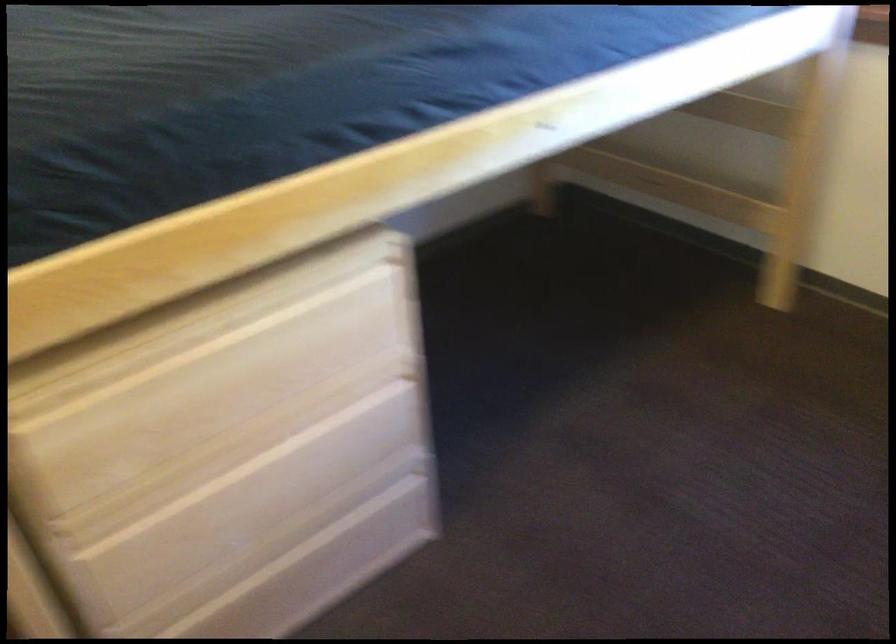
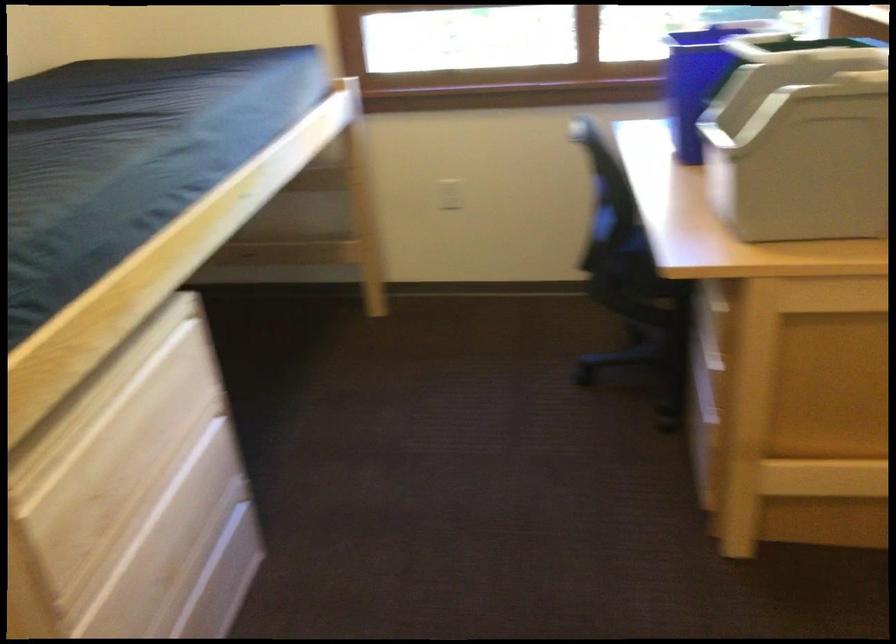
Question: The first image is from the beginning of the video and the second image is from the end. How did the camera likely rotate when shooting the video?

Choices:
 (A) Left
 (B) Right
 (C) Up
 (D) Down

Answer: (B)